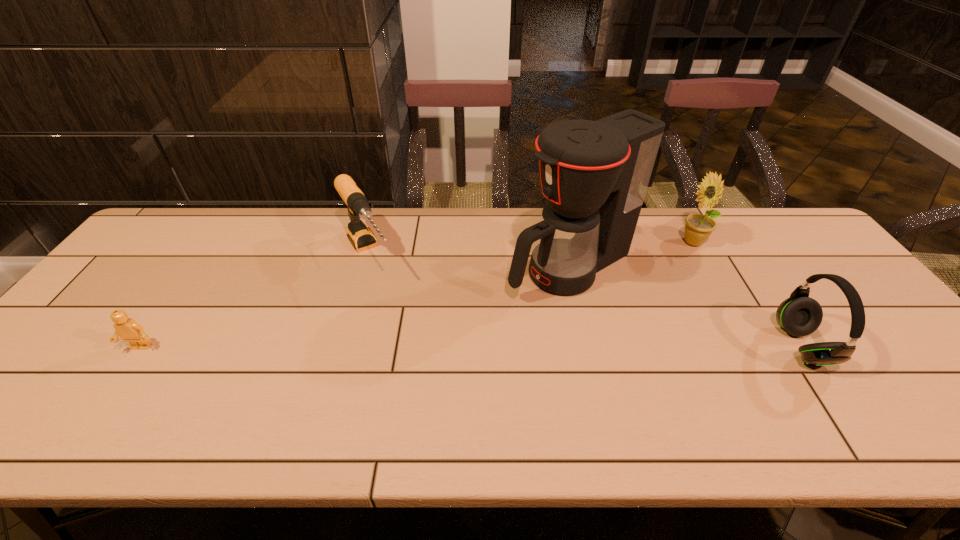
This screenshot has width=960, height=540. What are the coordinates of `vacant space on the desktop that is between the shortest object and the headset and is positioned pour from the carafe of the tallest object` in the screenshot? It's located at (424, 347).

I want to click on vacant space on the desktop that is between the shortest object and the headset and is positioned on the face of the fourth object from left to right, so click(x=569, y=347).

Where is `vacant space on the desktop that is between the leftmost object and the headset and is positioned on the handle side of the drill`? The image size is (960, 540). vacant space on the desktop that is between the leftmost object and the headset and is positioned on the handle side of the drill is located at coordinates (430, 347).